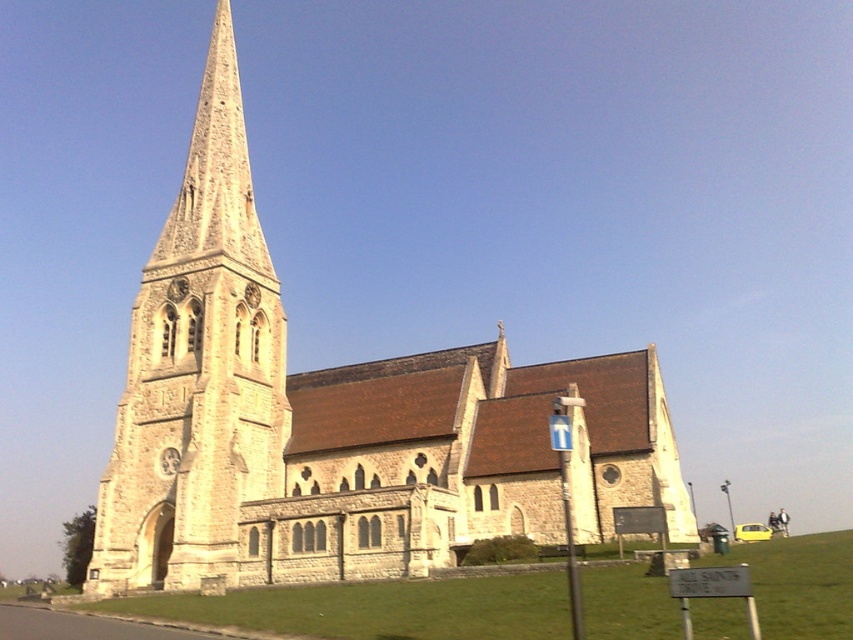
Which is above, light beige stone church at center or stone steeple at center?

Positioned higher is stone steeple at center.

Is light beige stone church at center bigger than stone steeple at center?

Indeed, light beige stone church at center has a larger size compared to stone steeple at center.

Where is `light beige stone church at center`? Image resolution: width=853 pixels, height=640 pixels. light beige stone church at center is located at coordinates (337, 419).

Image resolution: width=853 pixels, height=640 pixels. I want to click on light beige stone church at center, so click(337, 419).

Which of these two, stone steeple at center or green grass at lower center, stands shorter?

green grass at lower center is shorter.

You are a GUI agent. You are given a task and a screenshot of the screen. Output one action in this format:
    pyautogui.click(x=<x>, y=<y>)
    Task: Click on the stone steeple at center
    
    Given the screenshot: What is the action you would take?
    pyautogui.click(x=196, y=369)

Image resolution: width=853 pixels, height=640 pixels. What do you see at coordinates (337, 419) in the screenshot? I see `light beige stone church at center` at bounding box center [337, 419].

Is light beige stone church at center positioned before green grass at lower center?

No, light beige stone church at center is behind green grass at lower center.

Which is in front, point (351, 435) or point (514, 608)?

Positioned in front is point (514, 608).

Find the location of `light beige stone church at center`. light beige stone church at center is located at coordinates (337, 419).